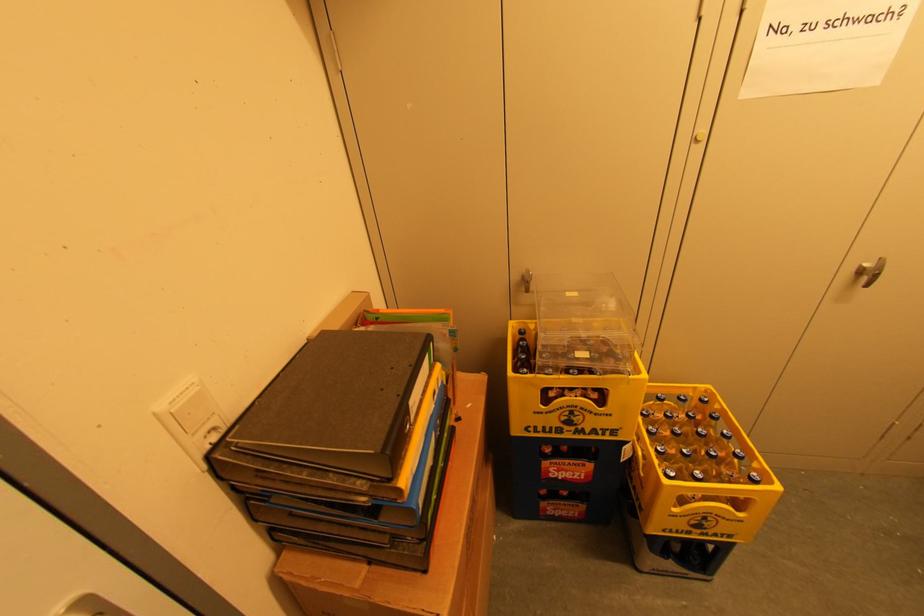
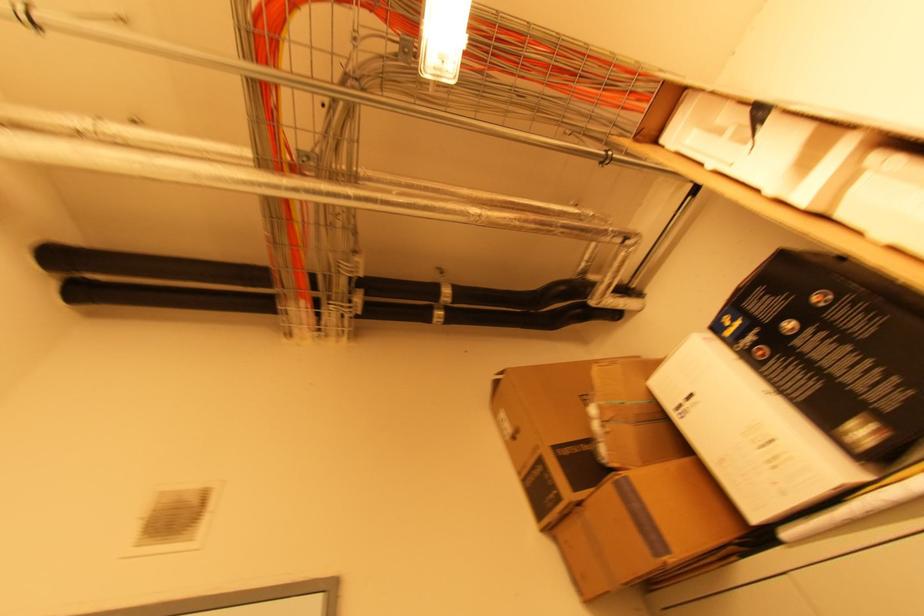
Based on the continuous images, in which direction is the camera rotating?

The rotation direction of the camera is left-up.